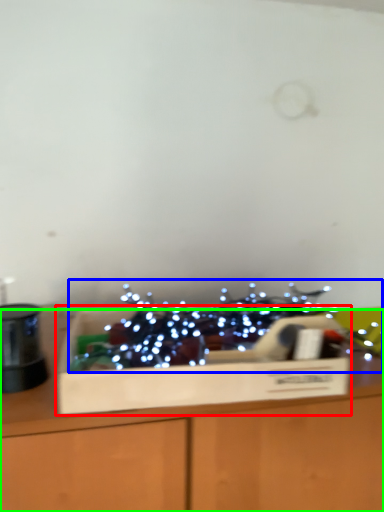
Question: Which object is the farthest from cardboard box (highlighted by a red box)? Choose among these: christmas decoration (highlighted by a blue box) or table (highlighted by a green box).

Choices:
 (A) christmas decoration
 (B) table

Answer: (A)